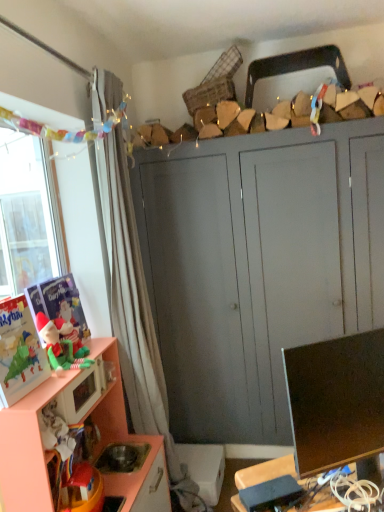
Question: Does matte pink microwave at lower left have a larger size compared to matte black monitor at lower right?

Choices:
 (A) no
 (B) yes

Answer: (A)

Question: From a real-world perspective, is matte pink microwave at lower left located higher than matte black monitor at lower right?

Choices:
 (A) no
 (B) yes

Answer: (A)

Question: Would you consider matte pink microwave at lower left to be distant from matte black monitor at lower right?

Choices:
 (A) yes
 (B) no

Answer: (B)

Question: From the image's perspective, is matte pink microwave at lower left on matte black monitor at lower right?

Choices:
 (A) yes
 (B) no

Answer: (B)

Question: Considering the relative sizes of matte pink microwave at lower left and matte black monitor at lower right in the image provided, is matte pink microwave at lower left taller than matte black monitor at lower right?

Choices:
 (A) yes
 (B) no

Answer: (B)

Question: From the image's perspective, is peach wood cabinet at lower left, the first cabinetry viewed from the front, above or below matte pink microwave at lower left?

Choices:
 (A) above
 (B) below

Answer: (B)

Question: Does point (8, 460) appear closer or farther from the camera than point (104, 374)?

Choices:
 (A) closer
 (B) farther

Answer: (A)

Question: Is peach wood cabinet at lower left, the first cabinetry viewed from the front, taller or shorter than matte pink microwave at lower left?

Choices:
 (A) short
 (B) tall

Answer: (B)

Question: Considering their positions, is peach wood cabinet at lower left, the first cabinetry viewed from the front, located in front of or behind matte pink microwave at lower left?

Choices:
 (A) front
 (B) behind

Answer: (A)

Question: Is peach wood cabinet at lower left, positioned as the second cabinetry in back-to-front order, wider or thinner than matte black monitor at lower right?

Choices:
 (A) thin
 (B) wide

Answer: (B)

Question: Considering the positions of peach wood cabinet at lower left, positioned as the second cabinetry in back-to-front order, and matte black monitor at lower right in the image, is peach wood cabinet at lower left, positioned as the second cabinetry in back-to-front order, taller or shorter than matte black monitor at lower right?

Choices:
 (A) short
 (B) tall

Answer: (B)

Question: Is peach wood cabinet at lower left, positioned as the second cabinetry in back-to-front order, to the left or to the right of matte black monitor at lower right in the image?

Choices:
 (A) left
 (B) right

Answer: (A)

Question: Which is correct: peach wood cabinet at lower left, positioned as the second cabinetry in back-to-front order, is inside matte black monitor at lower right, or outside of it?

Choices:
 (A) outside
 (B) inside

Answer: (A)

Question: Does point (322, 435) appear closer or farther from the camera than point (100, 75)?

Choices:
 (A) farther
 (B) closer

Answer: (B)

Question: In terms of size, does matte black monitor at lower right appear bigger or smaller than white sheer curtain at left?

Choices:
 (A) big
 (B) small

Answer: (B)